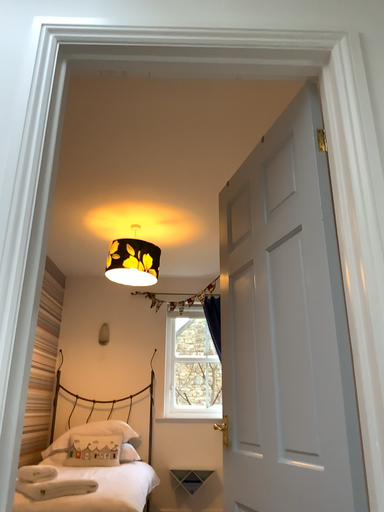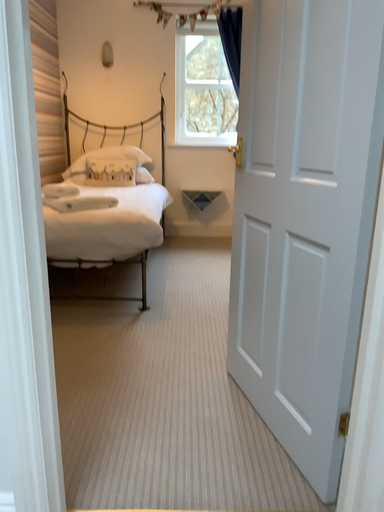
Question: Which way did the camera rotate in the video?

Choices:
 (A) rotated upward
 (B) rotated downward

Answer: (B)